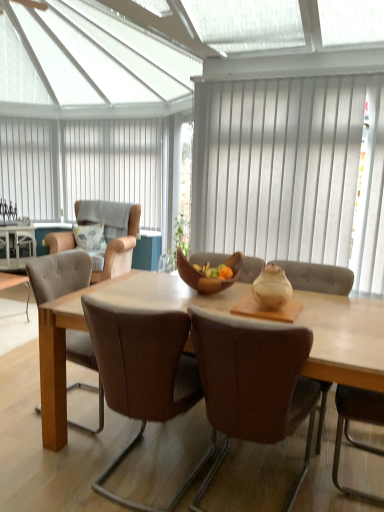
Question: From the image's perspective, is brown leather chair at left, the third chair viewed from the front, below beige fabric armchair at left, which ranks as the 4th chair in front-to-back order?

Choices:
 (A) yes
 (B) no

Answer: (A)

Question: Does brown leather chair at left, the 2th chair in the back-to-front sequence, have a lesser height compared to beige fabric armchair at left, which ranks as the 4th chair in front-to-back order?

Choices:
 (A) yes
 (B) no

Answer: (A)

Question: Is brown leather chair at left, the third chair viewed from the front, next to beige fabric armchair at left, which ranks as the 4th chair in front-to-back order?

Choices:
 (A) yes
 (B) no

Answer: (B)

Question: Is brown leather chair at left, the third chair viewed from the front, outside of beige fabric armchair at left, which ranks as the 4th chair in front-to-back order?

Choices:
 (A) no
 (B) yes

Answer: (B)

Question: Considering the relative positions of brown leather chair at left, the 2th chair in the back-to-front sequence, and beige fabric armchair at left, which ranks as the 4th chair in front-to-back order, in the image provided, is brown leather chair at left, the 2th chair in the back-to-front sequence, to the right of beige fabric armchair at left, which ranks as the 4th chair in front-to-back order, from the viewer's perspective?

Choices:
 (A) yes
 (B) no

Answer: (A)

Question: From the image's perspective, is white textured curtain at center, placed as the first curtain when sorted from front to back, above or below brown leather chair at center, which is the second chair from front to back?

Choices:
 (A) below
 (B) above

Answer: (B)

Question: Is white textured curtain at center, the second curtain viewed from the left, in front of or behind brown leather chair at center, which is counted as the third chair, starting from the back, in the image?

Choices:
 (A) front
 (B) behind

Answer: (B)

Question: Considering the positions of white textured curtain at center, positioned as the 2th curtain in back-to-front order, and brown leather chair at center, which is the second chair from front to back, in the image, is white textured curtain at center, positioned as the 2th curtain in back-to-front order, wider or thinner than brown leather chair at center, which is the second chair from front to back,?

Choices:
 (A) thin
 (B) wide

Answer: (A)

Question: Is white textured curtain at center, placed as the first curtain when sorted from front to back, bigger or smaller than brown leather chair at center, which is the second chair from front to back?

Choices:
 (A) small
 (B) big

Answer: (A)

Question: From the image's perspective, is brown leather chair at left, the 2th chair in the back-to-front sequence, above or below white vertical blinds at upper center, marked as the second curtain in a front-to-back arrangement?

Choices:
 (A) above
 (B) below

Answer: (B)

Question: Is brown leather chair at left, the 2th chair in the back-to-front sequence, to the left or to the right of white vertical blinds at upper center, arranged as the 1th curtain when viewed from the left, in the image?

Choices:
 (A) left
 (B) right

Answer: (B)

Question: From a real-world perspective, is brown leather chair at left, the third chair viewed from the front, positioned above or below white vertical blinds at upper center, positioned as the 1th curtain in back-to-front order?

Choices:
 (A) below
 (B) above

Answer: (A)

Question: Considering the positions of point click(66, 286) and point click(132, 143), is point click(66, 286) closer or farther from the camera than point click(132, 143)?

Choices:
 (A) closer
 (B) farther

Answer: (A)

Question: Considering the relative positions of brown leather chair at center, which is the second chair from front to back, and brown leather chair at center, which is the first chair in front-to-back order, in the image provided, is brown leather chair at center, which is the second chair from front to back, to the left or to the right of brown leather chair at center, which is the first chair in front-to-back order,?

Choices:
 (A) left
 (B) right

Answer: (A)

Question: From the image's perspective, is brown leather chair at center, which is the second chair from front to back, located above or below brown leather chair at center, which is the first chair in front-to-back order?

Choices:
 (A) below
 (B) above

Answer: (B)